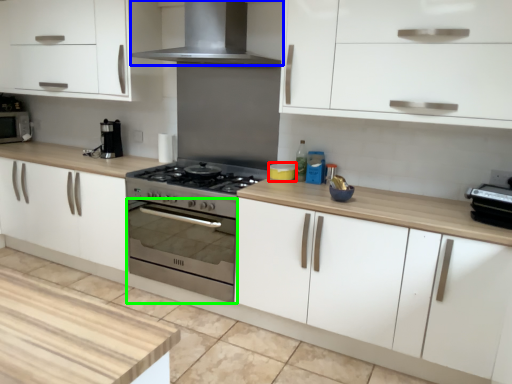
Question: Which object is positioned closest to appliance (highlighted by a red box)? Select from home appliance (highlighted by a blue box) and oven (highlighted by a green box).

Choices:
 (A) home appliance
 (B) oven

Answer: (B)